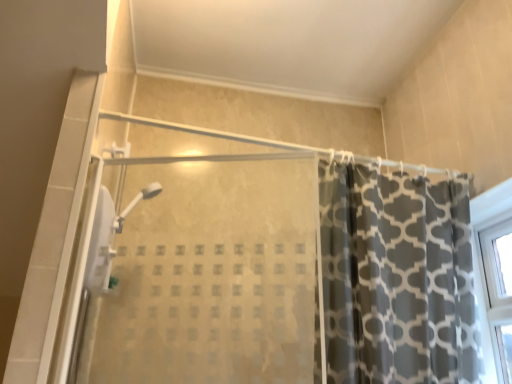
Question: Is dark gray printed fabric curtain at right at the right side of transparent glass shower door at center?

Choices:
 (A) yes
 (B) no

Answer: (A)

Question: Considering the relative positions of dark gray printed fabric curtain at right and transparent glass shower door at center in the image provided, is dark gray printed fabric curtain at right behind transparent glass shower door at center?

Choices:
 (A) no
 (B) yes

Answer: (B)

Question: Would you say dark gray printed fabric curtain at right is a long distance from transparent glass shower door at center?

Choices:
 (A) yes
 (B) no

Answer: (B)

Question: Can you confirm if dark gray printed fabric curtain at right is taller than transparent glass shower door at center?

Choices:
 (A) yes
 (B) no

Answer: (A)

Question: Is dark gray printed fabric curtain at right positioned in front of transparent glass shower door at center?

Choices:
 (A) no
 (B) yes

Answer: (A)

Question: Is dark gray printed fabric curtain at right surrounding transparent glass shower door at center?

Choices:
 (A) no
 (B) yes

Answer: (A)

Question: Is transparent glass shower door at center bigger than dark gray printed fabric curtain at right?

Choices:
 (A) no
 (B) yes

Answer: (A)

Question: From a real-world perspective, is transparent glass shower door at center under dark gray printed fabric curtain at right?

Choices:
 (A) no
 (B) yes

Answer: (B)

Question: Considering the relative sizes of transparent glass shower door at center and dark gray printed fabric curtain at right in the image provided, is transparent glass shower door at center taller than dark gray printed fabric curtain at right?

Choices:
 (A) yes
 (B) no

Answer: (B)

Question: Is transparent glass shower door at center with dark gray printed fabric curtain at right?

Choices:
 (A) yes
 (B) no

Answer: (B)

Question: From a real-world perspective, is transparent glass shower door at center on top of dark gray printed fabric curtain at right?

Choices:
 (A) yes
 (B) no

Answer: (B)

Question: Is the position of transparent glass shower door at center more distant than that of dark gray printed fabric curtain at right?

Choices:
 (A) no
 (B) yes

Answer: (A)

Question: Based on their positions, is transparent glass shower door at center located to the left or right of dark gray printed fabric curtain at right?

Choices:
 (A) left
 (B) right

Answer: (A)